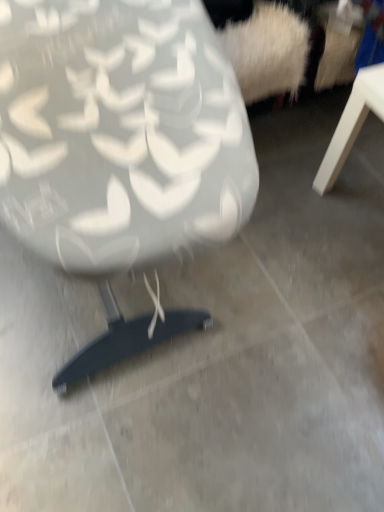
Question: From the image's perspective, is matte white chair at center above or below white matte table at right?

Choices:
 (A) above
 (B) below

Answer: (A)

Question: Considering the relative positions of matte white chair at center and white matte table at right in the image provided, is matte white chair at center to the left or to the right of white matte table at right?

Choices:
 (A) right
 (B) left

Answer: (B)

Question: Is point (238, 117) closer or farther from the camera than point (350, 141)?

Choices:
 (A) closer
 (B) farther

Answer: (A)

Question: In terms of width, does white matte table at right look wider or thinner when compared to matte white chair at center?

Choices:
 (A) thin
 (B) wide

Answer: (A)

Question: From a real-world perspective, is white matte table at right positioned above or below matte white chair at center?

Choices:
 (A) below
 (B) above

Answer: (A)

Question: Considering the positions of white matte table at right and matte white chair at center in the image, is white matte table at right bigger or smaller than matte white chair at center?

Choices:
 (A) big
 (B) small

Answer: (B)

Question: Is white matte table at right inside or outside of matte white chair at center?

Choices:
 (A) outside
 (B) inside

Answer: (A)